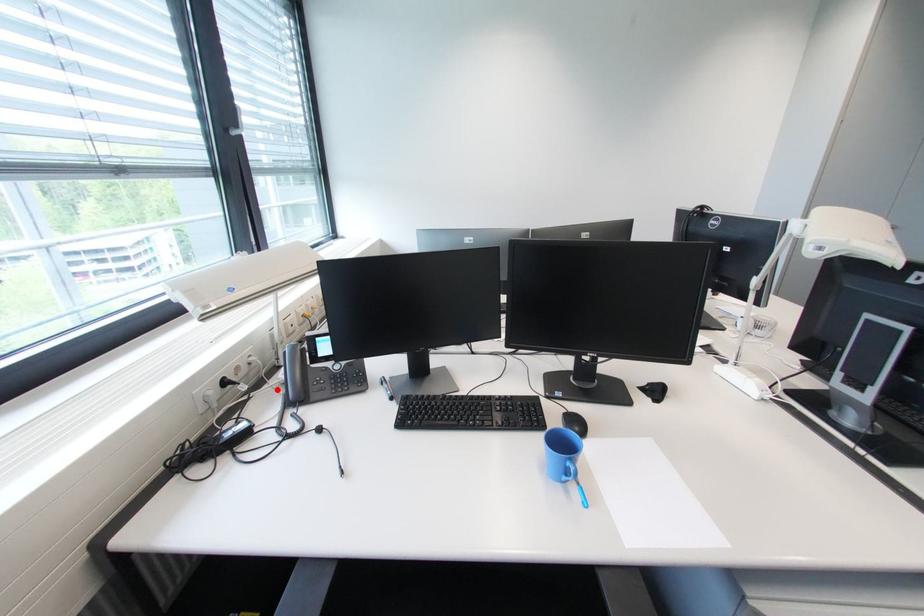
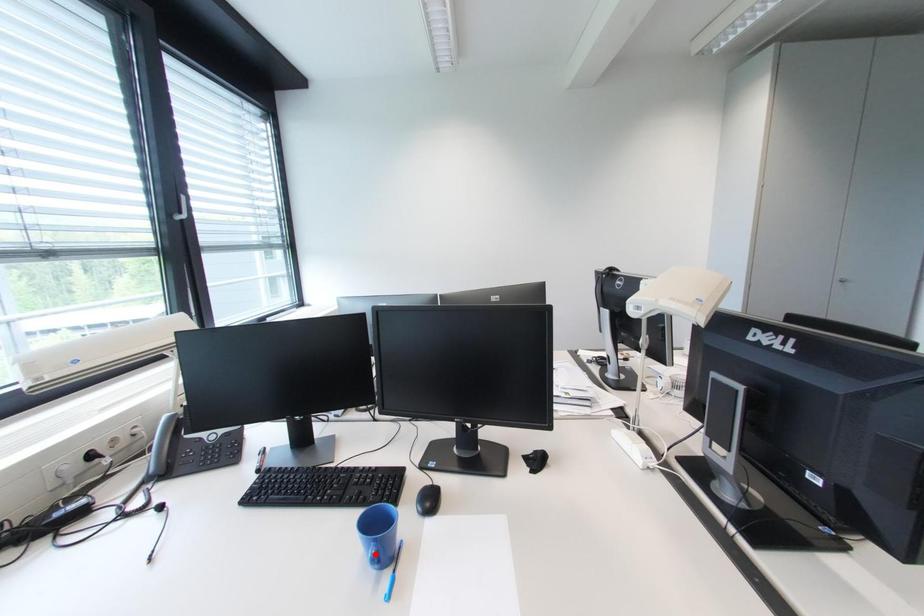
I am providing you with two images of the same scene from different viewpoints. A red point is marked on the first image and another point is marked on the second image. Is the marked point in image1 the same physical position as the marked point in image2?

No